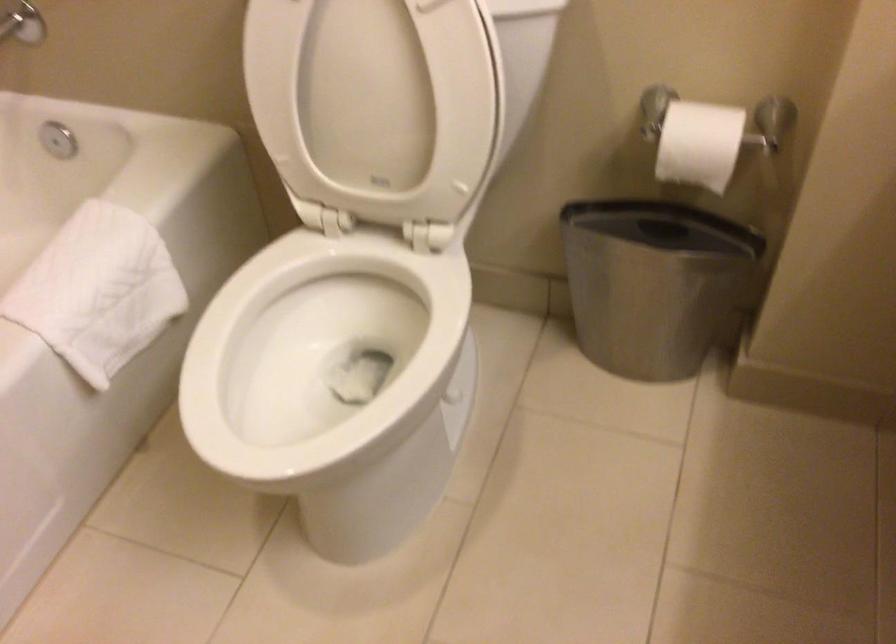
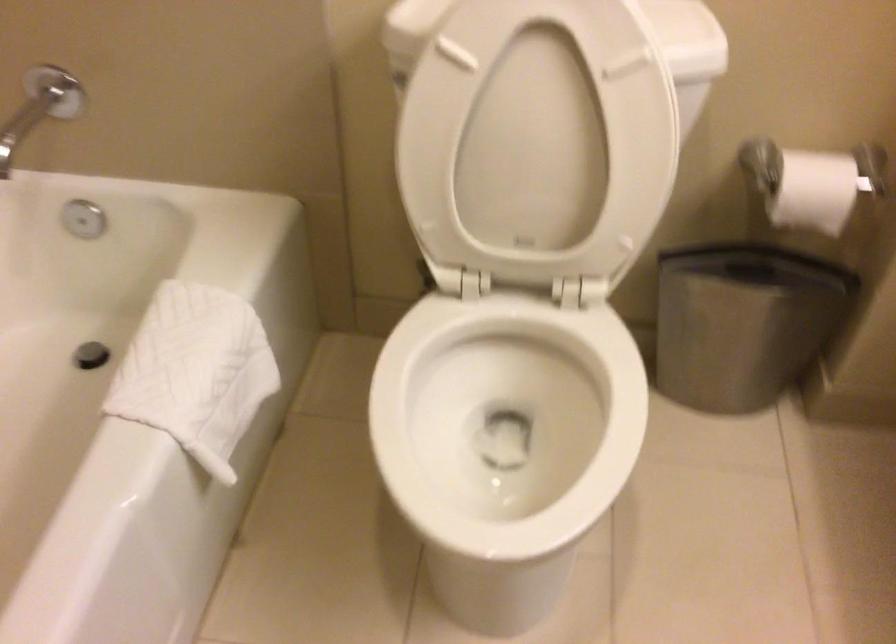
Question: The camera is either moving clockwise (left) or counter-clockwise (right) around the object. The first image is from the beginning of the video and the second image is from the end. Is the camera moving left or right when shooting the video?

Choices:
 (A) Left
 (B) Right

Answer: (A)